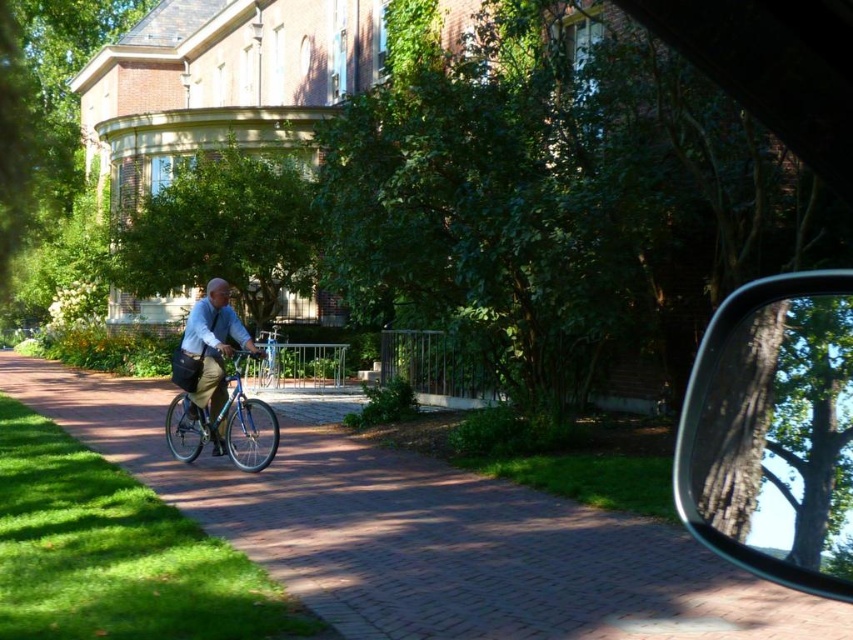
Can you confirm if brick pavement at center is shorter than blue metallic bicycle at center?

Yes, brick pavement at center is shorter than blue metallic bicycle at center.

Is brick pavement at center above blue metallic bicycle at center?

Incorrect, brick pavement at center is not positioned above blue metallic bicycle at center.

Is point (299, 564) closer to camera compared to point (267, 358)?

Yes, point (299, 564) is closer to viewer.

This screenshot has width=853, height=640. In order to click on brick pavement at center in this screenshot , I will do pyautogui.click(x=426, y=534).

Can you confirm if shiny blue bicycle at center is wider than light blue fabric shirt at center?

Yes.

Locate an element on the screen. The width and height of the screenshot is (853, 640). shiny blue bicycle at center is located at coordinates (224, 426).

Who is positioned more to the left, smooth plastic mirror at right or shiny blue bicycle at center?

shiny blue bicycle at center

Which is in front, point (839, 314) or point (248, 353)?

Point (839, 314) is more forward.

Is point (799, 312) less distant than point (177, 410)?

Yes, point (799, 312) is closer to viewer.

This screenshot has width=853, height=640. I want to click on smooth plastic mirror at right, so click(x=773, y=433).